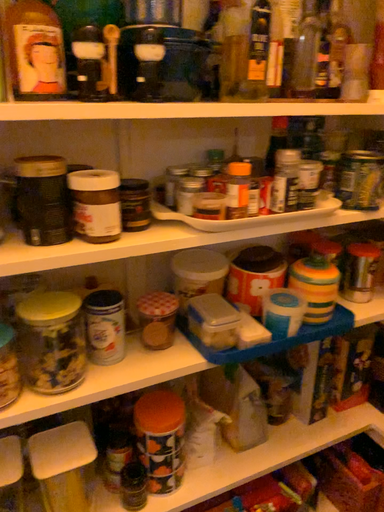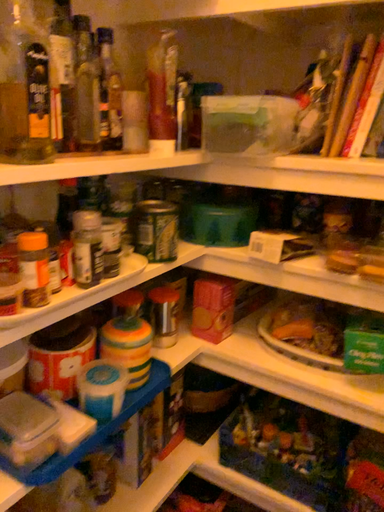
Question: How did the camera likely rotate when shooting the video?

Choices:
 (A) rotated right
 (B) rotated left

Answer: (A)